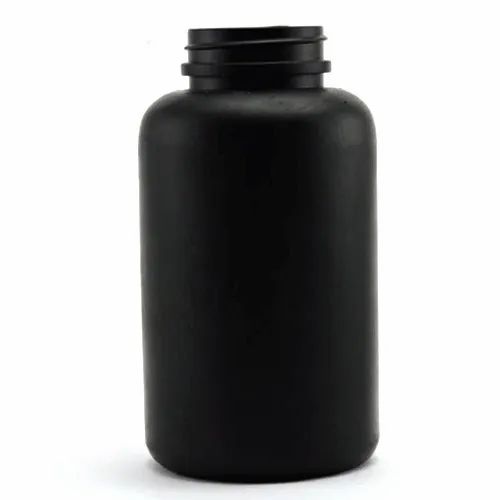
This screenshot has height=500, width=500. I want to click on white table, so click(135, 473).